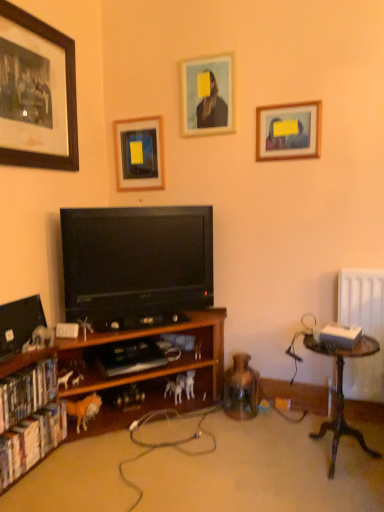
Where is `vacant space in front of white matte horse at lower center, placed as the first animal when sorted from right to left`? This screenshot has width=384, height=512. vacant space in front of white matte horse at lower center, placed as the first animal when sorted from right to left is located at coordinates (170, 419).